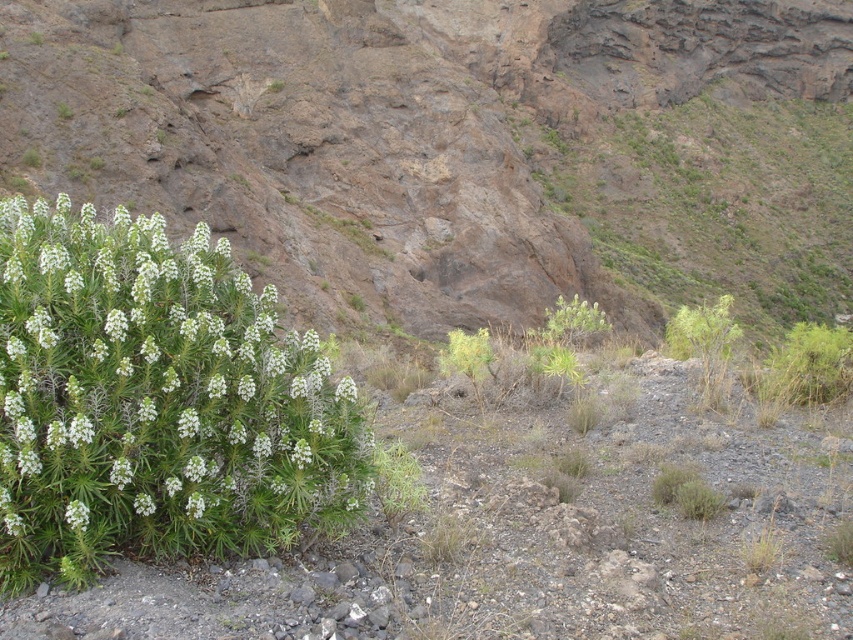
Question: Is green leafy plant at left closer to the viewer compared to green leafy plant at lower left?

Choices:
 (A) no
 (B) yes

Answer: (B)

Question: Which of the following is the farthest from the observer?

Choices:
 (A) green leafy plant at left
 (B) green grassy hillside at lower left
 (C) green leafy plant at lower left

Answer: (B)

Question: Is green leafy plant at left thinner than green leafy plant at lower left?

Choices:
 (A) no
 (B) yes

Answer: (A)

Question: Is green grassy hillside at lower left positioned behind green leafy plant at left?

Choices:
 (A) no
 (B) yes

Answer: (B)

Question: Which object is the farthest from the green leafy plant at lower left?

Choices:
 (A) green leafy plant at left
 (B) green grassy hillside at lower left

Answer: (B)

Question: Which of the following is the farthest from the observer?

Choices:
 (A) green grassy hillside at lower left
 (B) green leafy plant at left

Answer: (A)